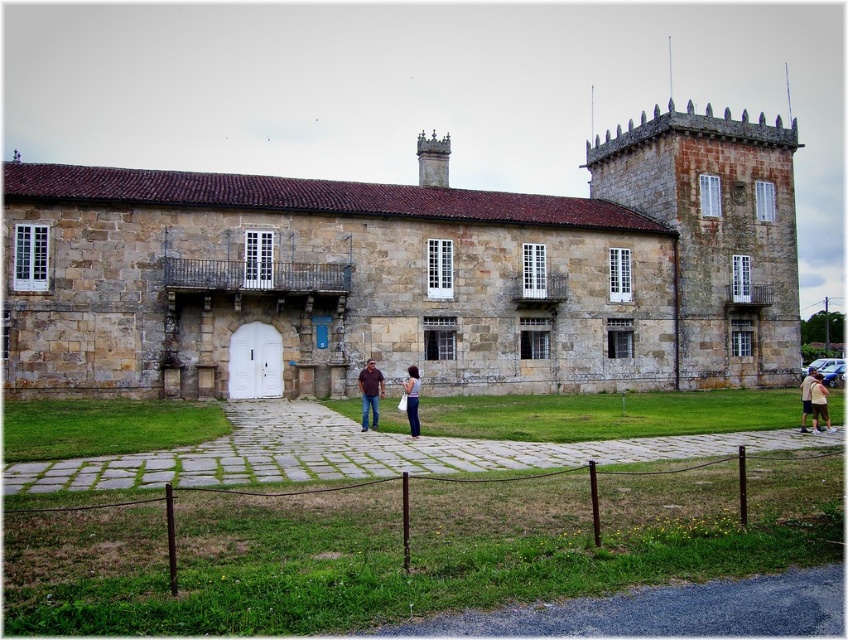
You are a fashion designer who wants to display the brown leather jacket at center and denim pants at center in a window display. Since the display space is limited, you need to know which item takes up more space. Which item should be placed first to optimize space?

The brown leather jacket at center is larger in size than the denim pants at center, so you should place the brown leather jacket at center first to accommodate its larger size before arranging the denim pants at center.

You are standing in front of the historic stone building and notice two items hanging on a rack near the entrance. The tan cotton shirt at center and the brown leather jacket at center. Which item is closer to you?

The tan cotton shirt at center is closer to you because it is further to the viewer than the brown leather jacket at center.